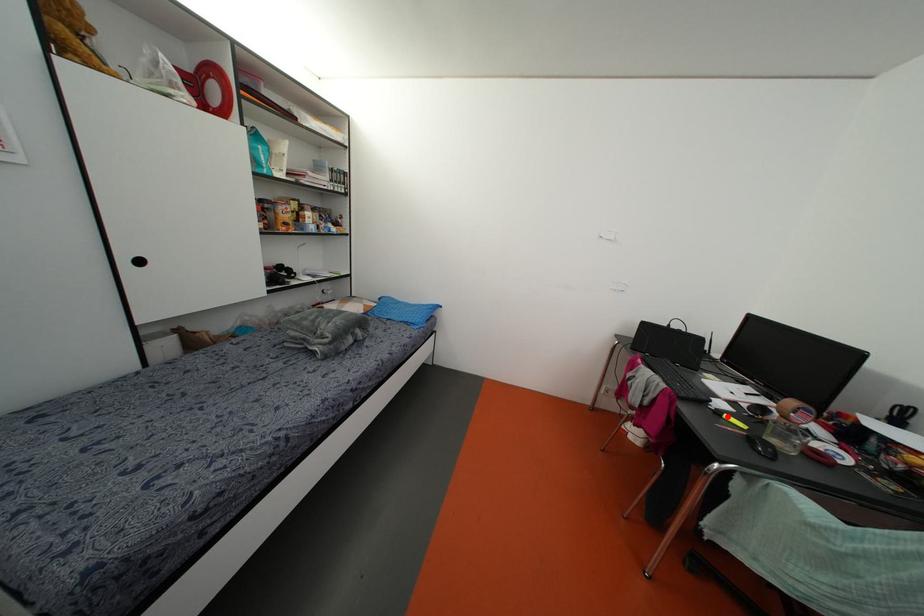
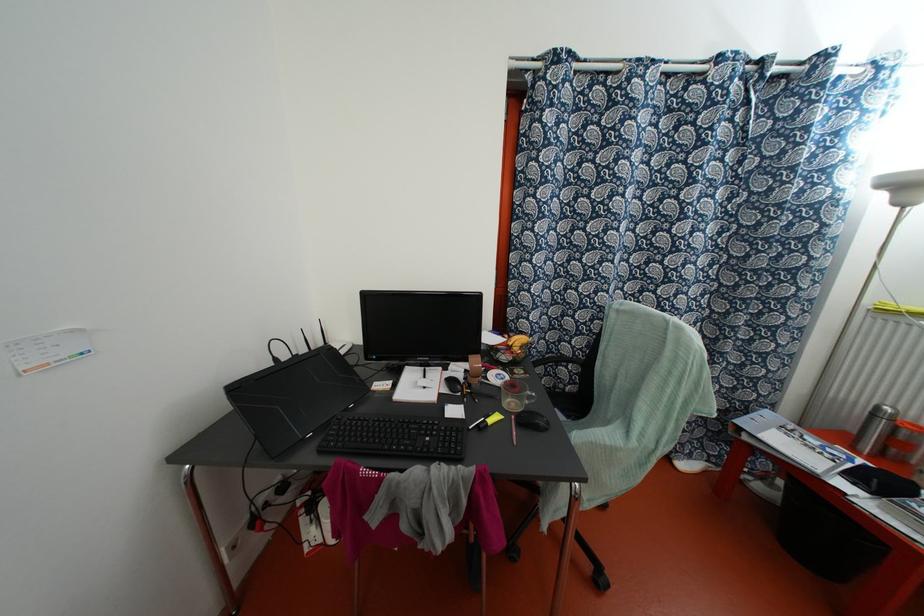
Locate, in the second image, the point that corresponds to the highlighted location in the first image.

(489, 421)